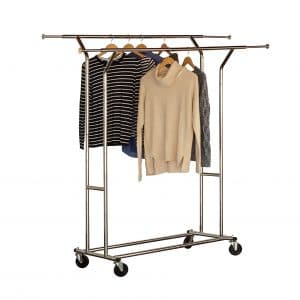
Locate an element on the screen. This screenshot has height=300, width=300. wooden hangers is located at coordinates (112, 45), (130, 46), (141, 46), (164, 47), (163, 61), (188, 61).